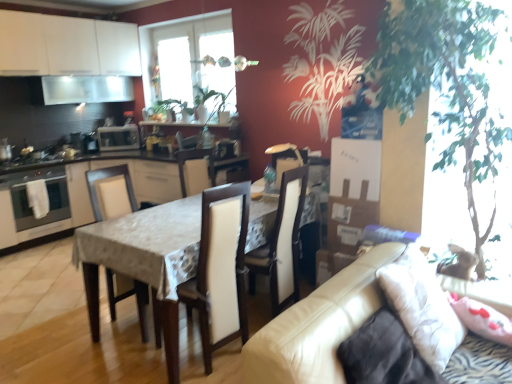
The height and width of the screenshot is (384, 512). I want to click on satin silver oven at left, so click(48, 197).

Image resolution: width=512 pixels, height=384 pixels. What are the coordinates of `transparent glass window at upper center` in the screenshot? It's located at (x=186, y=55).

Describe the element at coordinates (144, 260) in the screenshot. This screenshot has height=384, width=512. I see `wooden table at center` at that location.

Locate an element on the screen. The height and width of the screenshot is (384, 512). white glossy cabinets at center, positioned as the 2th cabinetry in top-to-bottom order is located at coordinates (126, 186).

The width and height of the screenshot is (512, 384). Describe the element at coordinates (175, 69) in the screenshot. I see `transparent glass window screen at upper center` at that location.

Identify the location of satin silver oven at left. (48, 197).

Is stainless steel oven at left facing away from green leafy plant at right?

No.

Consider the image. Is stainless steel oven at left far away from green leafy plant at right?

Indeed, stainless steel oven at left is not near green leafy plant at right.

From the picture: Who is shorter, stainless steel oven at left or green leafy plant at right?

stainless steel oven at left.

Which is in front, satin silver oven at left or wooden chair at center, the 2th chair from the right?

Positioned in front is wooden chair at center, the 2th chair from the right.

Between satin silver oven at left and wooden chair at center, acting as the 2th chair starting from the left, which one appears on the left side from the viewer's perspective?

satin silver oven at left.

The height and width of the screenshot is (384, 512). I want to click on oven above the wooden chair at center, acting as the 2th chair starting from the left (from a real-world perspective), so (x=48, y=197).

Who is smaller, leather couch at lower right or stainless steel oven at left?

With smaller size is stainless steel oven at left.

Considering the positions of objects leather couch at lower right and stainless steel oven at left in the image provided, who is more to the right, leather couch at lower right or stainless steel oven at left?

From the viewer's perspective, leather couch at lower right appears more on the right side.

Is leather couch at lower right positioned far away from stainless steel oven at left?

leather couch at lower right is far away from stainless steel oven at left.

How different are the orientations of leather couch at lower right and stainless steel oven at left in degrees?

They differ by 4.85e-05 degrees in their facing directions.

Consider the image. Does wooden table at center have a lesser height compared to white fabric chair at center, arranged as the 1th chair when viewed from the left?

Yes, wooden table at center is shorter than white fabric chair at center, arranged as the 1th chair when viewed from the left.

Does wooden table at center appear on the left side of white fabric chair at center, arranged as the 1th chair when viewed from the left?

In fact, wooden table at center is to the right of white fabric chair at center, arranged as the 1th chair when viewed from the left.

Which object is closer to the camera, wooden table at center or white fabric chair at center, arranged as the 1th chair when viewed from the left?

Positioned in front is wooden table at center.

Consider the image. Can you see wooden table at center touching white fabric chair at center, arranged as the third chair when viewed from the right?

They are not placed beside each other.

Is the surface of white fabric chair at center, arranged as the third chair when viewed from the right, in direct contact with wooden table at center?

They are not placed beside each other.

Considering the positions of objects white fabric chair at center, arranged as the 1th chair when viewed from the left, and wooden table at center in the image provided, who is more to the right, white fabric chair at center, arranged as the 1th chair when viewed from the left, or wooden table at center?

From the viewer's perspective, wooden table at center appears more on the right side.

Where is `table in front of the white fabric chair at center, arranged as the 1th chair when viewed from the left`? The width and height of the screenshot is (512, 384). table in front of the white fabric chair at center, arranged as the 1th chair when viewed from the left is located at coordinates (144, 260).

Could you tell me if white fabric chair at center, arranged as the 1th chair when viewed from the left, is facing wooden table at center?

Yes, white fabric chair at center, arranged as the 1th chair when viewed from the left, faces towards wooden table at center.

From the image's perspective, is transparent glass window at upper center above or below satin silver microwave at upper left?

Clearly, from the image's perspective, transparent glass window at upper center is above satin silver microwave at upper left.

Is transparent glass window at upper center wider than satin silver microwave at upper left?

No, transparent glass window at upper center is not wider than satin silver microwave at upper left.

Does transparent glass window at upper center lie behind satin silver microwave at upper left?

That is False.

The image size is (512, 384). Identify the location of table on the right of stainless steel oven at left. (144, 260).

Is point (152, 269) in front of point (3, 157)?

Yes, point (152, 269) is closer to viewer.

Looking at their sizes, would you say wooden table at center is wider or thinner than stainless steel oven at left?

wooden table at center is wider than stainless steel oven at left.

Considering the sizes of objects wooden table at center and stainless steel oven at left in the image provided, who is shorter, wooden table at center or stainless steel oven at left?

With less height is stainless steel oven at left.

The height and width of the screenshot is (384, 512). In the image, there is a stainless steel oven at left. Find the location of `plant below it (from the image's perspective)`. plant below it (from the image's perspective) is located at coordinates (447, 84).

In order to click on the 3rd chair in front of the satin silver oven at left, counting from the anchor's position in this screenshot , I will do `click(220, 271)`.

Based on their spatial positions, is leather couch at lower right or transparent glass window at upper center further from wooden chair at center, acting as the 2th chair starting from the left?

transparent glass window at upper center is further to wooden chair at center, acting as the 2th chair starting from the left.

Looking at the image, which one is located further to transparent glass window at upper center, green leafy plant at right or stainless steel oven at left?

green leafy plant at right.

Estimate the real-world distances between objects in this image. Which object is further from wooden chair at center, the 2th chair from the right, transparent glass window at upper center or stainless steel oven at left?

The object further to wooden chair at center, the 2th chair from the right, is stainless steel oven at left.

Considering their positions, is satin silver oven at left positioned closer to transparent glass window screen at upper center than white glossy cabinets at center, the 1th cabinetry ordered from the bottom?

Among the two, white glossy cabinets at center, the 1th cabinetry ordered from the bottom, is located nearer to transparent glass window screen at upper center.

Looking at this image, from the image, which object appears to be nearer to white fabric pillow at right, green leafy plant at right or stainless steel oven at left?

green leafy plant at right is closer to white fabric pillow at right.

Estimate the real-world distances between objects in this image. Which object is closer to white glossy cabinets at upper left, the 2th cabinetry ordered from the bottom, transparent glass window screen at upper center or green leafy plant at right?

Among the two, transparent glass window screen at upper center is located nearer to white glossy cabinets at upper left, the 2th cabinetry ordered from the bottom.

Consider the image. Looking at the image, which one is located closer to green leafy plant at right, white fabric pillow at right or stainless steel oven at left?

white fabric pillow at right is closer to green leafy plant at right.

Consider the image. When comparing their distances from green leafy plant at right, does white glossy cabinets at center, positioned as the 2th cabinetry in top-to-bottom order, or stainless steel oven at left seem closer?

Among the two, white glossy cabinets at center, positioned as the 2th cabinetry in top-to-bottom order, is located nearer to green leafy plant at right.

Where is `oven between white fabric chair at center, arranged as the third chair when viewed from the right, and transparent glass window at upper center from front to back`? Image resolution: width=512 pixels, height=384 pixels. oven between white fabric chair at center, arranged as the third chair when viewed from the right, and transparent glass window at upper center from front to back is located at coordinates (48, 197).

Where is `window between stainless steel oven at left and white leather chair at center, placed as the 3th chair when sorted from left to right`? window between stainless steel oven at left and white leather chair at center, placed as the 3th chair when sorted from left to right is located at coordinates (186, 55).

Where is `window located between white fabric pillow at right and transparent glass window screen at upper center in the depth direction`? The image size is (512, 384). window located between white fabric pillow at right and transparent glass window screen at upper center in the depth direction is located at coordinates (186, 55).

Identify the location of oven positioned between white leather chair at center, the 1th chair viewed from the right, and satin silver microwave at upper left from near to far. This screenshot has width=512, height=384. (48, 197).